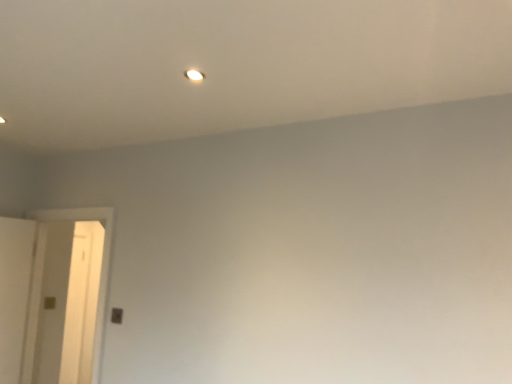
What do you see at coordinates (99, 285) in the screenshot? I see `white matte door at left` at bounding box center [99, 285].

Find the location of a particular element. This screenshot has width=512, height=384. white matte door at left is located at coordinates 99,285.

Locate an element on the screen. The image size is (512, 384). white glossy light at upper center is located at coordinates (194, 75).

What do you see at coordinates (194, 75) in the screenshot? Image resolution: width=512 pixels, height=384 pixels. I see `white glossy light at upper center` at bounding box center [194, 75].

Locate an element on the screen. The image size is (512, 384). white matte door at left is located at coordinates (99, 285).

Is white glossy light at upper center at the left side of white matte door at left?

Incorrect, white glossy light at upper center is not on the left side of white matte door at left.

Between white glossy light at upper center and white matte door at left, which one is positioned in front?

white glossy light at upper center is closer to the camera.

Which is farther, (x=203, y=78) or (x=104, y=288)?

The point (x=104, y=288) is farther from the camera.

From the image's perspective, is white glossy light at upper center below white matte door at left?

No.

From a real-world perspective, is white glossy light at upper center under white matte door at left?

No, from a real-world perspective, white glossy light at upper center is not under white matte door at left.

Is white glossy light at upper center wider or thinner than white matte door at left?

Clearly, white glossy light at upper center has less width compared to white matte door at left.

Is white glossy light at upper center taller or shorter than white matte door at left?

Clearly, white glossy light at upper center is shorter compared to white matte door at left.

Is white glossy light at upper center bigger or smaller than white matte door at left?

→ Clearly, white glossy light at upper center is smaller in size than white matte door at left.

Is white glossy light at upper center inside or outside of white matte door at left?

white glossy light at upper center lies outside white matte door at left.

Does white glossy light at upper center touch white matte door at left?

No, white glossy light at upper center is not making contact with white matte door at left.

Is white glossy light at upper center looking in the opposite direction of white matte door at left?

No, white matte door at left is not at the back of white glossy light at upper center.

How different are the orientations of white glossy light at upper center and white matte door at left in degrees?

white glossy light at upper center and white matte door at left are facing 0.382 degrees away from each other.

Locate an element on the screen. The image size is (512, 384). door on the left of white glossy light at upper center is located at coordinates 99,285.

Is white matte door at left at the left side of white glossy light at upper center?

Yes, white matte door at left is to the left of white glossy light at upper center.

Is white matte door at left positioned before white glossy light at upper center?

No.

Is point (33, 281) more distant than point (196, 72)?

Yes, it is.

From the image's perspective, is white matte door at left above or below white glossy light at upper center?

Based on their image positions, white matte door at left is located beneath white glossy light at upper center.

From a real-world perspective, which object rests below the other?

white matte door at left.

Is white matte door at left wider than white glossy light at upper center?

Indeed, white matte door at left has a greater width compared to white glossy light at upper center.

Considering the sizes of objects white matte door at left and white glossy light at upper center in the image provided, who is taller, white matte door at left or white glossy light at upper center?

With more height is white matte door at left.

Between white matte door at left and white glossy light at upper center, which one has smaller size?

With smaller size is white glossy light at upper center.

From the picture: Is white matte door at left positioned beyond the bounds of white glossy light at upper center?

white matte door at left is positioned outside white glossy light at upper center.

Is white matte door at left in contact with white glossy light at upper center?

No, white matte door at left is not next to white glossy light at upper center.

Is white matte door at left turned away from white glossy light at upper center?

No, white matte door at left is not facing away from white glossy light at upper center.

Identify the location of door behind the white glossy light at upper center. (99, 285).

The height and width of the screenshot is (384, 512). In order to click on door behind the white glossy light at upper center in this screenshot , I will do `click(99, 285)`.

There is a white matte door at left. At what (x,y) coordinates should I click in order to perform the action: click on light above it (from a real-world perspective). Please return your answer as a coordinate pair (x, y). The width and height of the screenshot is (512, 384). Looking at the image, I should click on tap(194, 75).